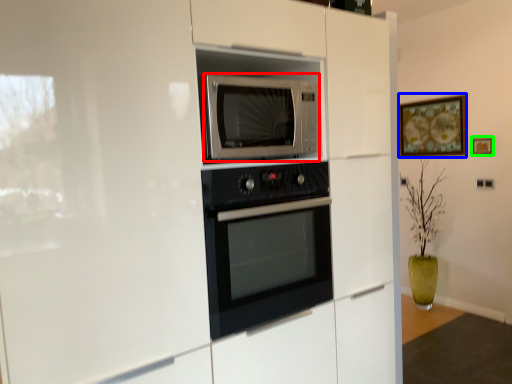
Question: Considering the real-world distances, which object is farthest from microwave oven (highlighted by a red box)? picture frame (highlighted by a blue box) or picture frame (highlighted by a green box)?

Choices:
 (A) picture frame
 (B) picture frame

Answer: (A)